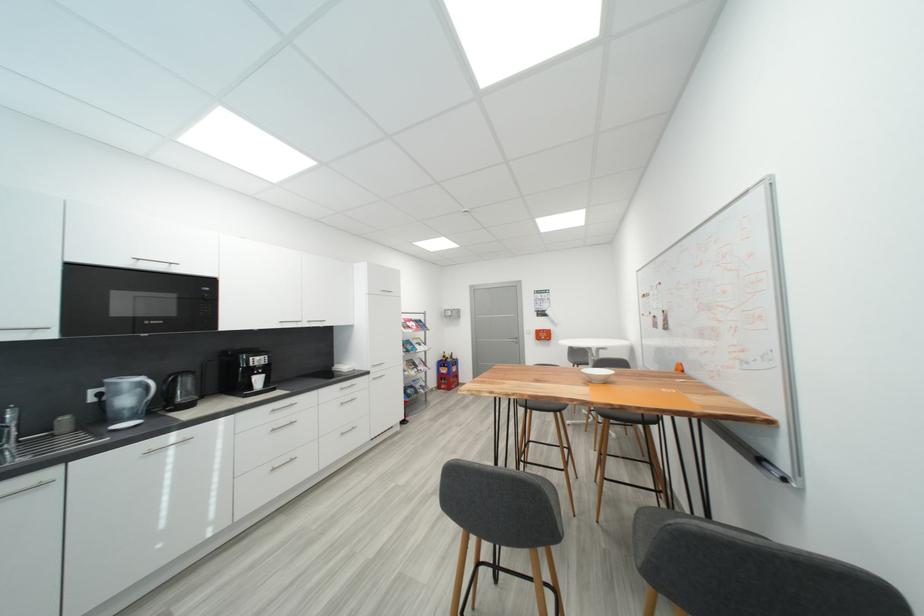
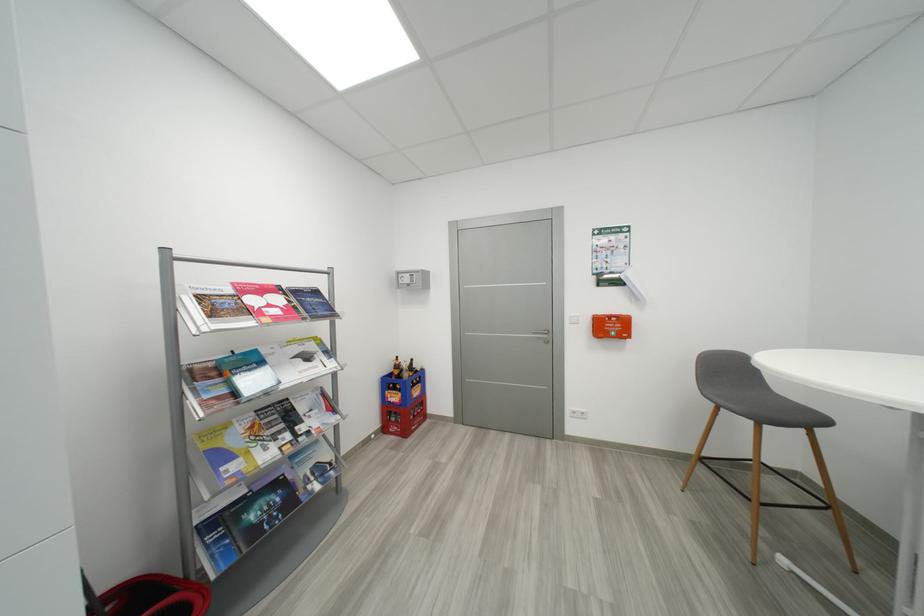
The point at (445,389) is marked in the first image. Where is the corresponding point in the second image?

(392, 431)